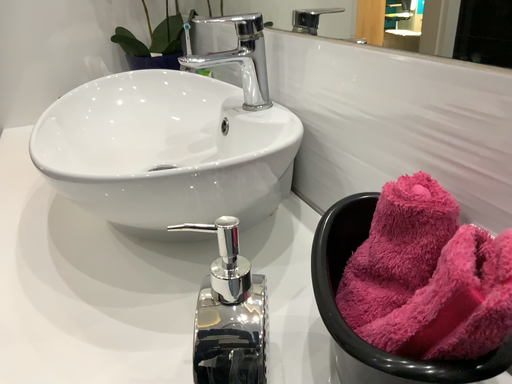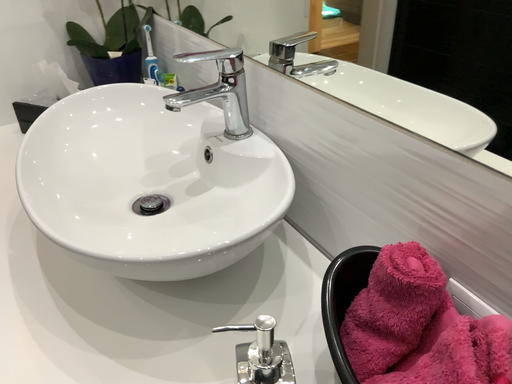
Question: How did the camera likely rotate when shooting the video?

Choices:
 (A) rotated upward
 (B) rotated downward

Answer: (B)